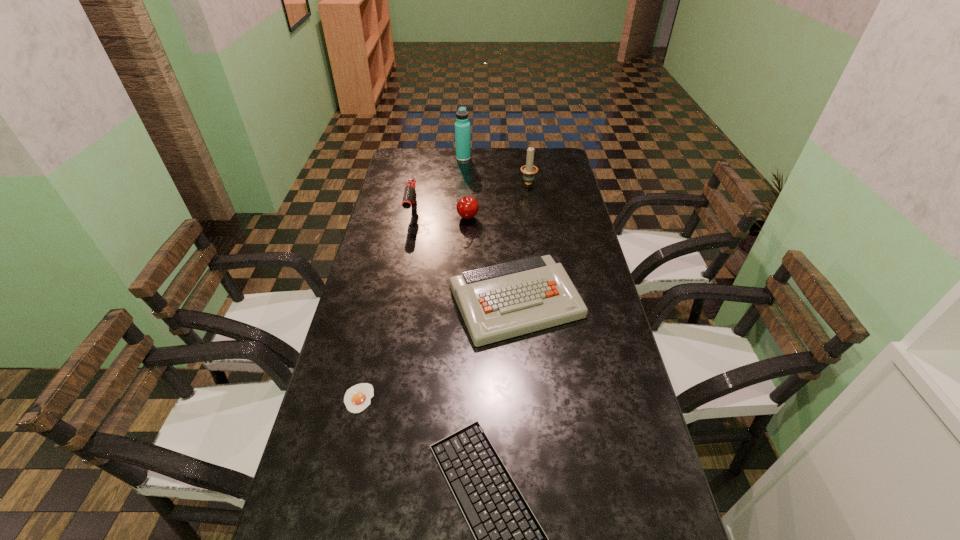
Find the location of a particular element. The image size is (960, 540). thermos bottle is located at coordinates (462, 126).

Where is `the tallest object`? This screenshot has width=960, height=540. the tallest object is located at coordinates (462, 126).

I want to click on candle_holder, so click(x=529, y=170).

Identify the location of the sixth shortest object. (529, 170).

I want to click on gun, so [x=409, y=198].

You are a GUI agent. You are given a task and a screenshot of the screen. Output one action in this format:
    pyautogui.click(x=<x>, y=<y>)
    Task: Click on the cherry
    The image size is (960, 540).
    Given the screenshot: What is the action you would take?
    point(467,207)

Locate an element on the screen. the farther computer keyboard is located at coordinates (499, 302).

The image size is (960, 540). I want to click on the third nearest object, so click(499, 302).

Locate an element on the screen. Image resolution: width=960 pixels, height=540 pixels. the shortest object is located at coordinates (357, 398).

Where is `the sixth farthest object`? This screenshot has height=540, width=960. the sixth farthest object is located at coordinates (357, 398).